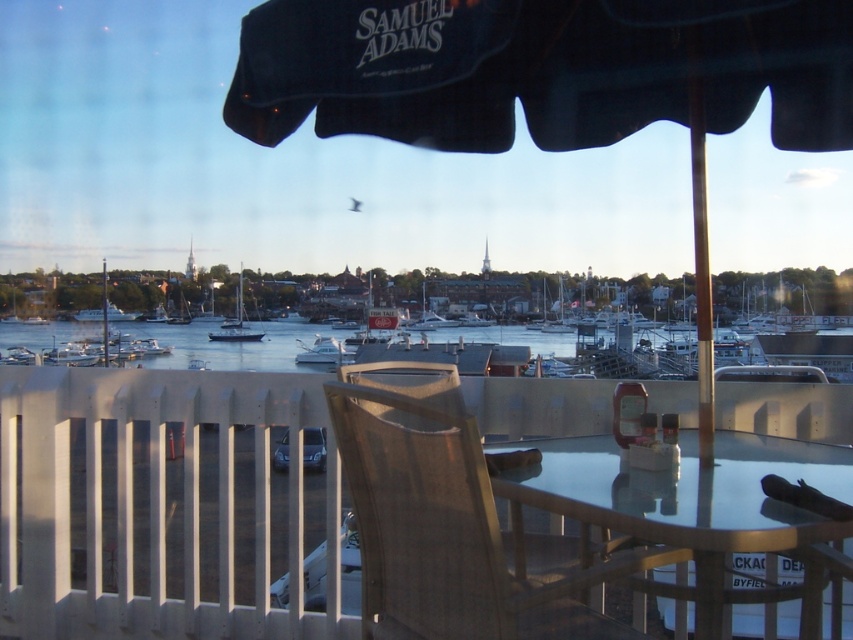
Question: Can you confirm if wooden railing at lower center is positioned above white matte boat at center?

Choices:
 (A) no
 (B) yes

Answer: (A)

Question: Estimate the real-world distances between objects in this image. Which object is closer to the sandy beige fabric chair at center?

Choices:
 (A) white matte sailboat at center
 (B) white matte boat at center

Answer: (B)

Question: Which point is closer to the camera?

Choices:
 (A) sandy beige fabric chair at center
 (B) wooden railing at lower center
 (C) white matte sailboat at center

Answer: (B)

Question: Based on their relative distances, which object is farther from the white matte sailboat at center?

Choices:
 (A) wooden railing at lower center
 (B) transparent glass table at center
 (C) white matte boat at center
 (D) sandy beige fabric chair at center

Answer: (D)

Question: Is wooden railing at lower center closer to the viewer compared to transparent glass table at center?

Choices:
 (A) yes
 (B) no

Answer: (B)

Question: Is white matte boat at center below white matte sailboat at center?

Choices:
 (A) yes
 (B) no

Answer: (A)